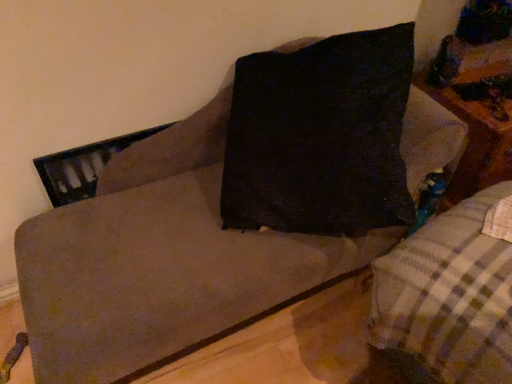
Question: Should I look upward or downward to see plaid fabric couch at center?

Choices:
 (A) up
 (B) down

Answer: (B)

Question: From a real-world perspective, is plaid fabric couch at center physically above wooden table at right?

Choices:
 (A) no
 (B) yes

Answer: (A)

Question: Would you say plaid fabric couch at center is outside wooden table at right?

Choices:
 (A) no
 (B) yes

Answer: (B)

Question: Does plaid fabric couch at center appear on the left side of wooden table at right?

Choices:
 (A) no
 (B) yes

Answer: (B)

Question: From the image's perspective, is plaid fabric couch at center under wooden table at right?

Choices:
 (A) no
 (B) yes

Answer: (B)

Question: Is plaid fabric couch at center shorter than wooden table at right?

Choices:
 (A) no
 (B) yes

Answer: (A)

Question: From the image's perspective, would you say plaid fabric couch at center is positioned over wooden table at right?

Choices:
 (A) no
 (B) yes

Answer: (A)

Question: Is wooden table at right at the right side of plaid fabric couch at center?

Choices:
 (A) no
 (B) yes

Answer: (B)

Question: Considering the relative sizes of wooden table at right and plaid fabric couch at center in the image provided, is wooden table at right smaller than plaid fabric couch at center?

Choices:
 (A) yes
 (B) no

Answer: (A)

Question: From the image's perspective, is wooden table at right below plaid fabric couch at center?

Choices:
 (A) no
 (B) yes

Answer: (A)

Question: Is wooden table at right with plaid fabric couch at center?

Choices:
 (A) yes
 (B) no

Answer: (B)

Question: Is plaid fabric couch at center a part of wooden table at right?

Choices:
 (A) no
 (B) yes

Answer: (A)

Question: Are wooden table at right and plaid fabric couch at center located far from each other?

Choices:
 (A) no
 (B) yes

Answer: (A)

Question: Is wooden table at right bigger or smaller than plaid fabric couch at center?

Choices:
 (A) big
 (B) small

Answer: (B)